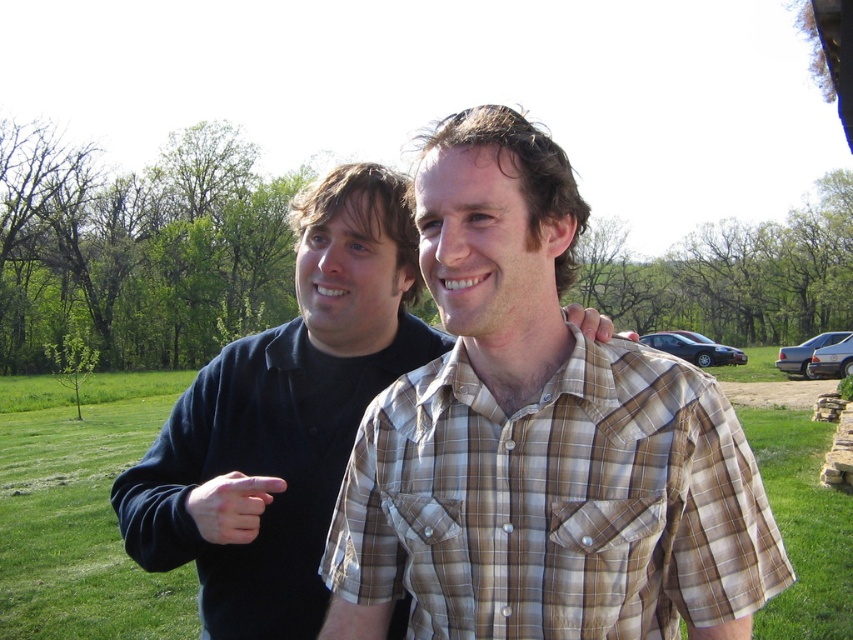
Question: Among these objects, which one is farthest from the camera?

Choices:
 (A) matte black finger at center
 (B) black cotton shirt at center
 (C) matte skin hand at center
 (D) brown plaid shirt at center

Answer: (B)

Question: Is matte black finger at center below matte skin hand at center?

Choices:
 (A) yes
 (B) no

Answer: (A)

Question: Which point is closer to the camera?

Choices:
 (A) (247, 474)
 (B) (582, 307)
 (C) (212, 506)
 (D) (526, 598)

Answer: (D)

Question: Is black cotton shirt at center bigger than matte skin hand at center?

Choices:
 (A) no
 (B) yes

Answer: (A)

Question: Can you confirm if brown plaid shirt at center is smaller than matte black finger at center?

Choices:
 (A) no
 (B) yes

Answer: (A)

Question: Which point appears farthest from the camera in this image?

Choices:
 (A) (567, 307)
 (B) (608, 348)
 (C) (332, 392)
 (D) (239, 477)

Answer: (C)